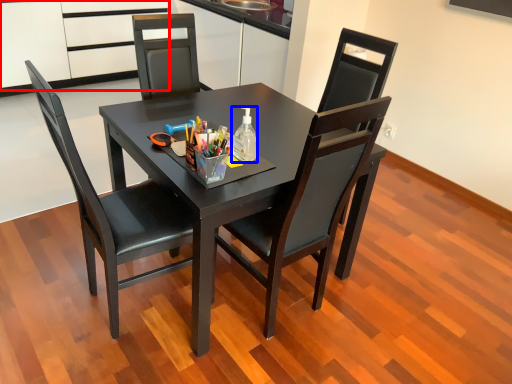
Question: Which object appears closest to the camera in this image, cabinetry (highlighted by a red box) or bottle (highlighted by a blue box)?

Choices:
 (A) cabinetry
 (B) bottle

Answer: (B)